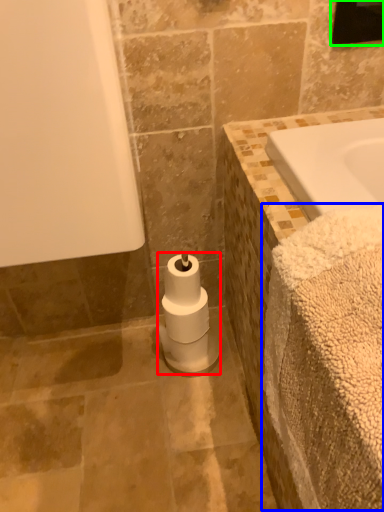
Question: Which is nearer to the toilet paper (highlighted by a red box)? bath towel (highlighted by a blue box) or mirror (highlighted by a green box).

Choices:
 (A) bath towel
 (B) mirror

Answer: (A)